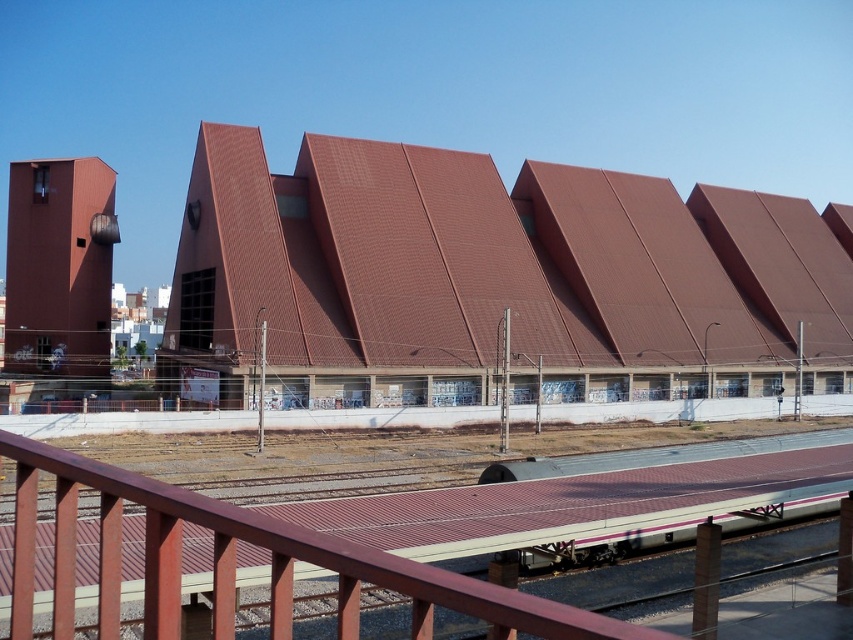
Question: Which point is farther to the camera?

Choices:
 (A) (589, 308)
 (B) (351, 620)

Answer: (A)

Question: Which point is closer to the camera?

Choices:
 (A) (253, 508)
 (B) (650, 276)

Answer: (A)

Question: Is brown corrugated metal roof at center thinner than metallic silver train at center?

Choices:
 (A) no
 (B) yes

Answer: (A)

Question: Among these objects, which one is nearest to the camera?

Choices:
 (A) metallic silver train at center
 (B) brown corrugated metal roof at center

Answer: (A)

Question: Does brown corrugated metal roof at center lie behind metallic silver train at center?

Choices:
 (A) no
 (B) yes

Answer: (B)

Question: Where is brown corrugated metal roof at center located in relation to metallic silver train at center in the image?

Choices:
 (A) left
 (B) right

Answer: (B)